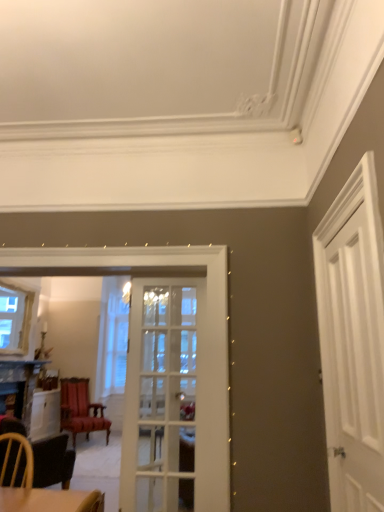
Question: Is white wooden door at right, which is counted as the 1th door, starting from the right, smaller than clear glass window at left?

Choices:
 (A) no
 (B) yes

Answer: (B)

Question: From the image's perspective, would you say white wooden door at right, the second door positioned from the back, is positioned over clear glass window at left?

Choices:
 (A) yes
 (B) no

Answer: (A)

Question: Does white wooden door at right, the second door positioned from the back, have a greater height compared to clear glass window at left?

Choices:
 (A) yes
 (B) no

Answer: (A)

Question: Is white wooden door at right, which is counted as the 1th door, starting from the right, positioned behind clear glass window at left?

Choices:
 (A) yes
 (B) no

Answer: (B)

Question: Can clear glass window at left be found inside white wooden door at right, placed as the 1th door when sorted from front to back?

Choices:
 (A) yes
 (B) no

Answer: (B)

Question: Does white wooden door at right, which is counted as the 1th door, starting from the right, appear on the left side of clear glass window at left?

Choices:
 (A) yes
 (B) no

Answer: (B)

Question: Is velvet red chair at center oriented towards white glass door at center, which ranks as the first door in back-to-front order?

Choices:
 (A) no
 (B) yes

Answer: (B)

Question: From a real-world perspective, is velvet red chair at center located beneath white glass door at center, which is the first door from left to right?

Choices:
 (A) yes
 (B) no

Answer: (A)

Question: Is velvet red chair at center turned away from white glass door at center, which is the first door from left to right?

Choices:
 (A) no
 (B) yes

Answer: (A)

Question: Can you confirm if velvet red chair at center is shorter than white glass door at center, the 2th door when ordered from front to back?

Choices:
 (A) no
 (B) yes

Answer: (B)

Question: Considering the relative sizes of velvet red chair at center and white glass door at center, which is the first door from left to right, in the image provided, is velvet red chair at center wider than white glass door at center, which is the first door from left to right,?

Choices:
 (A) yes
 (B) no

Answer: (A)

Question: Is velvet red chair at center positioned before white glass door at center, which is the first door from left to right?

Choices:
 (A) no
 (B) yes

Answer: (A)

Question: From the image's perspective, would you say white glass door at center, which is the first door from left to right, is shown under clear glass window at left?

Choices:
 (A) no
 (B) yes

Answer: (B)